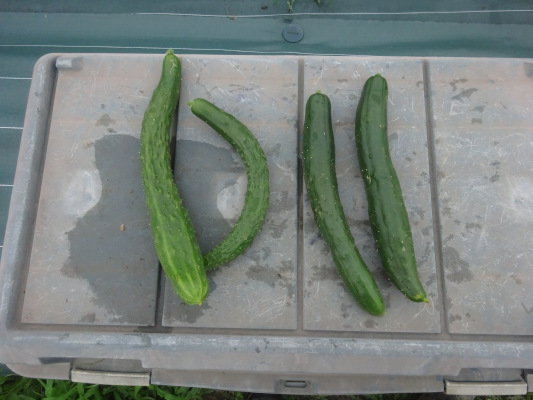
I want to click on box, so 104,184.